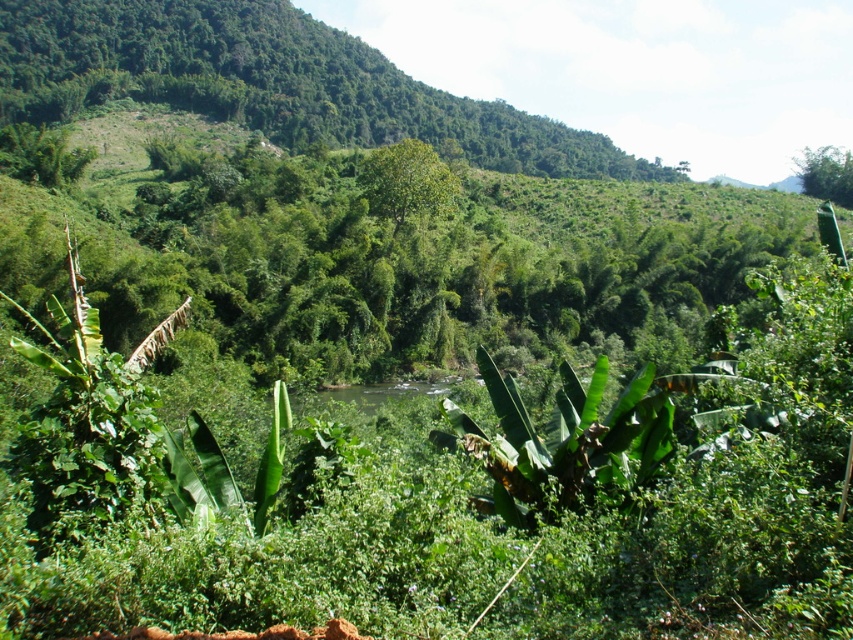
Question: Which of the following is the farthest from the observer?

Choices:
 (A) (426, 163)
 (B) (520, 428)

Answer: (A)

Question: Where is green leafy tree at center located in relation to green leafy tree at upper right in the image?

Choices:
 (A) right
 (B) left

Answer: (B)

Question: Can you confirm if green leafy tree at center is positioned below green leafy tree at upper right?

Choices:
 (A) yes
 (B) no

Answer: (A)

Question: Which object is positioned closest to the green leafy tree at center?

Choices:
 (A) green leafy banana tree at center
 (B) green leafy tree at upper right

Answer: (A)

Question: Where is green leafy tree at center located in relation to green leafy tree at upper right in the image?

Choices:
 (A) above
 (B) below

Answer: (B)

Question: Which point appears closest to the camera in this image?

Choices:
 (A) (817, 150)
 (B) (525, 502)
 (C) (375, 182)

Answer: (B)